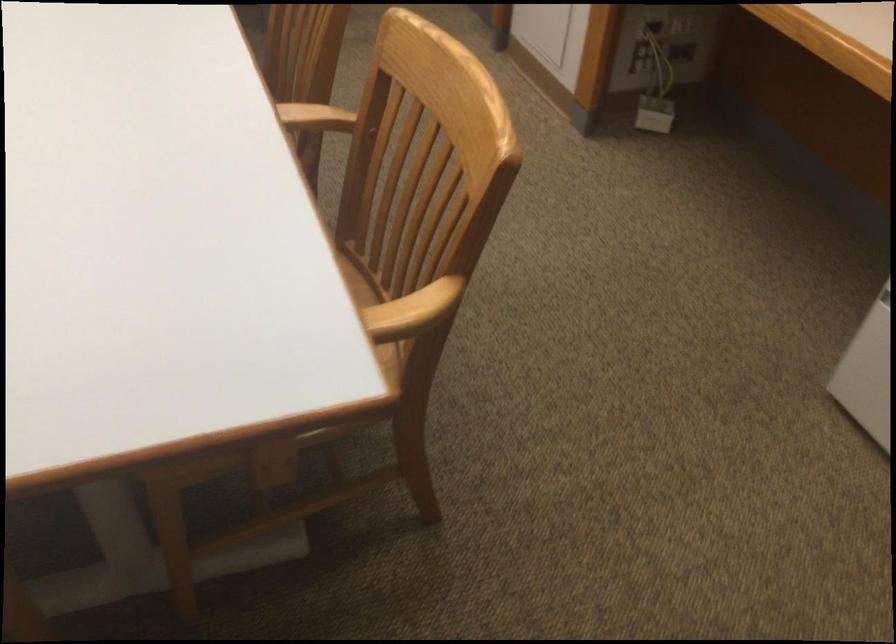
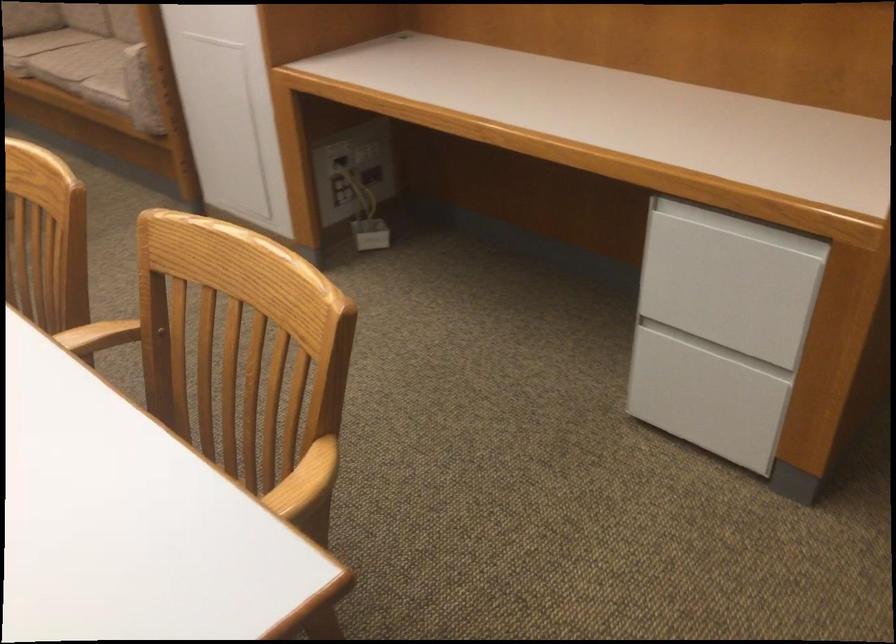
In the second image, find the point that corresponds to (323,116) in the first image.

(104, 335)